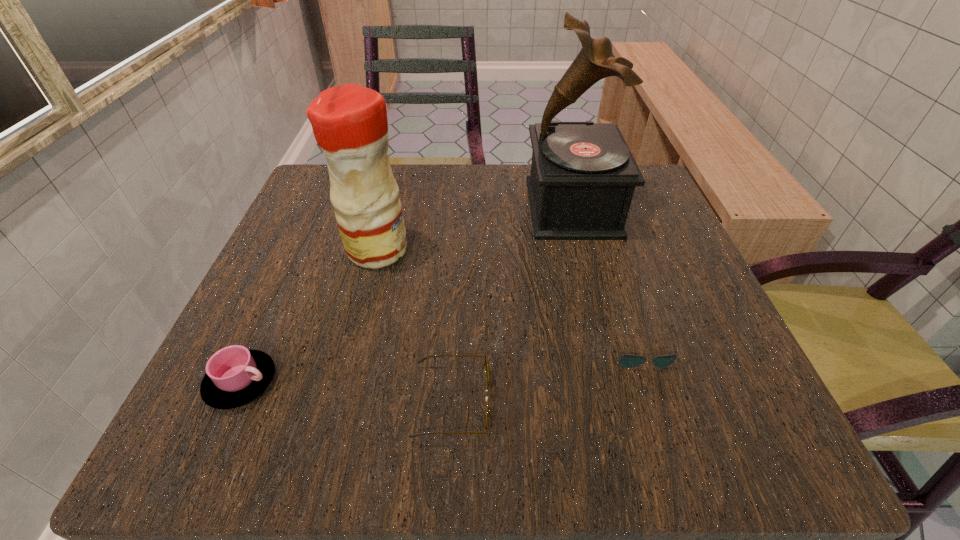
The height and width of the screenshot is (540, 960). Identify the location of phonograph_record. (583, 175).

At what (x,y) coordinates should I click in order to perform the action: click on condiment. Please return your answer as a coordinate pair (x, y). Looking at the image, I should click on (349, 122).

Find the location of a particular element. the fourth shortest object is located at coordinates (349, 122).

I want to click on cup, so click(235, 376).

I want to click on the taller sunglasses, so click(x=422, y=359).

Where is `the third object from right to left`? This screenshot has height=540, width=960. the third object from right to left is located at coordinates (422, 359).

This screenshot has height=540, width=960. Find the location of `the shorter sunglasses`. the shorter sunglasses is located at coordinates (627, 361).

Find the location of `the shortest object`. the shortest object is located at coordinates (627, 361).

Find the location of a particular element. This screenshot has width=960, height=540. free space located 0.160m at the horn opening of the phonograph_record is located at coordinates (453, 207).

At what (x,y) coordinates should I click in order to perform the action: click on vacant space located at the horn opening of the phonograph_record. Please return your answer as a coordinate pair (x, y). Looking at the image, I should click on (372, 207).